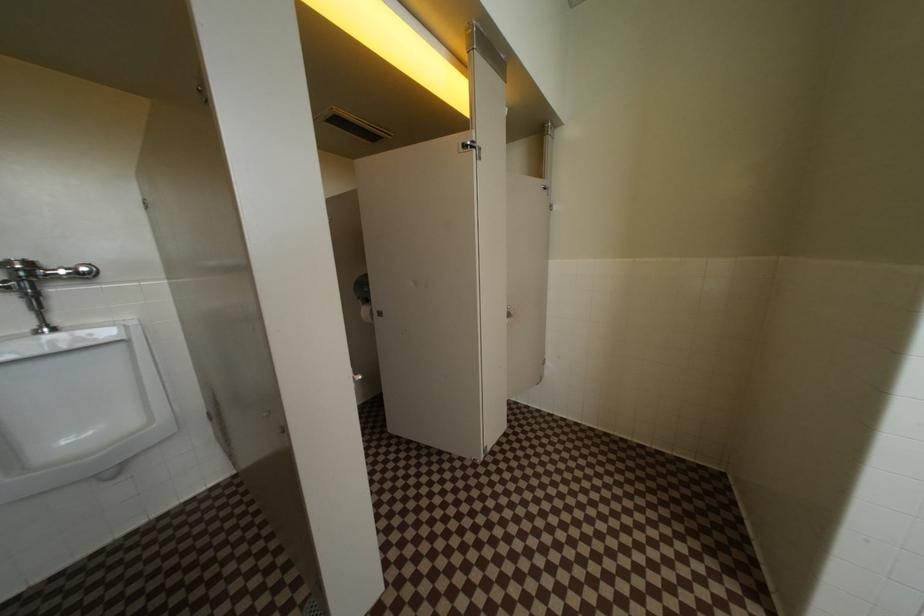
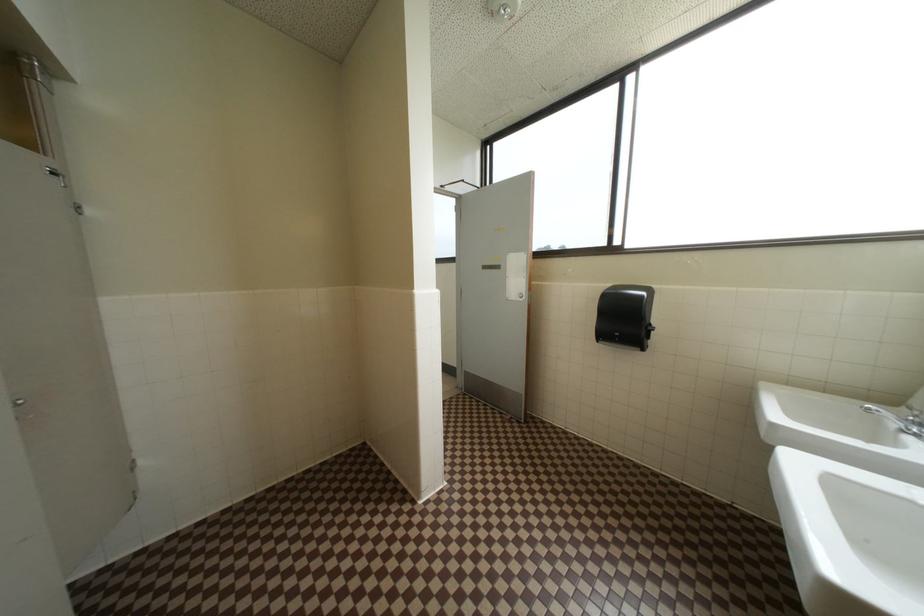
Question: How did the camera likely rotate?

Choices:
 (A) Left
 (B) Right
 (C) Up
 (D) Down

Answer: (B)